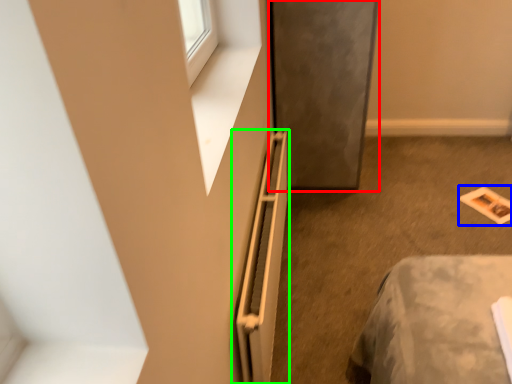
Question: Based on their relative distances, which object is farther from screen door (highlighted by a red box)? Choose from magazine (highlighted by a blue box) and radiator (highlighted by a green box).

Choices:
 (A) magazine
 (B) radiator

Answer: (A)